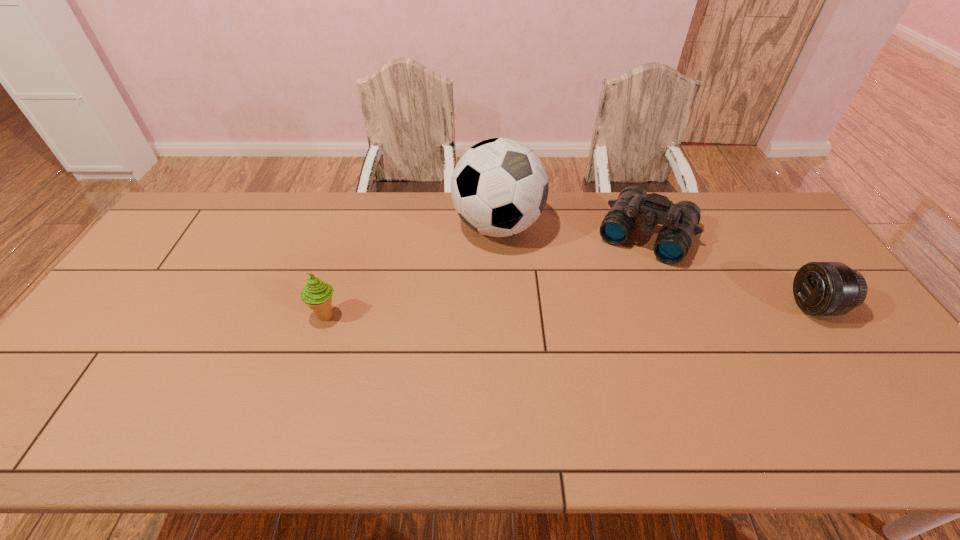
This screenshot has width=960, height=540. In order to click on vacant space located 0.400m through the lenses of the second object from right to left in this screenshot , I will do `click(583, 360)`.

At what (x,y) coordinates should I click in order to perform the action: click on vacant region located 0.200m through the lenses of the second object from right to left. Please return your answer as a coordinate pair (x, y). This screenshot has height=540, width=960. Looking at the image, I should click on (609, 308).

Identify the location of vacant area located 0.110m on the main logo of the tallest object. (553, 269).

I want to click on free location located on the main logo of the tallest object, so coord(567,281).

In order to click on vacant area situated 0.380m on the main logo of the tallest object in this screenshot , I will do [624, 326].

I want to click on binoculars present at the far edge, so click(x=679, y=221).

Identify the location of soccer ball present at the far edge. (499, 187).

Locate an element on the screen. This screenshot has height=540, width=960. object situated at the right edge is located at coordinates (820, 288).

Identify the location of vacant space at the far edge of the desktop. (245, 200).

Where is `vacant space at the near edge of the desktop`? The image size is (960, 540). vacant space at the near edge of the desktop is located at coordinates (178, 404).